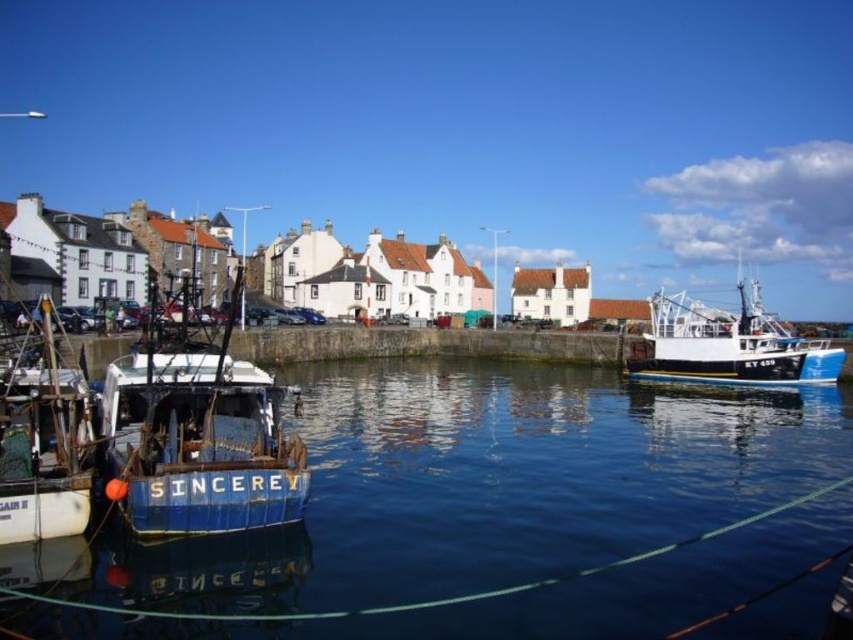
Identify the location of blue glossy water at center. This screenshot has width=853, height=640. (497, 513).

Is point (759, 568) less distant than point (676, 352)?

Yes, it is in front of point (676, 352).

Locate an element on the screen. This screenshot has width=853, height=640. blue glossy water at center is located at coordinates (497, 513).

Is blue glossy water at center smaller than blue matte boat at left?

Correct, blue glossy water at center occupies less space than blue matte boat at left.

Between blue glossy water at center and blue matte boat at left, which one is positioned higher?

blue matte boat at left is above.

What are the coordinates of `blue glossy water at center` in the screenshot? It's located at (497, 513).

Which of these two, blue glossy water at center or blue wooden boat at left, stands taller?

Standing taller between the two is blue wooden boat at left.

Who is higher up, blue glossy water at center or blue wooden boat at left?

blue wooden boat at left

Which is in front, point (840, 515) or point (49, 497)?

Point (49, 497)

Identify the location of blue glossy water at center. Image resolution: width=853 pixels, height=640 pixels. (497, 513).